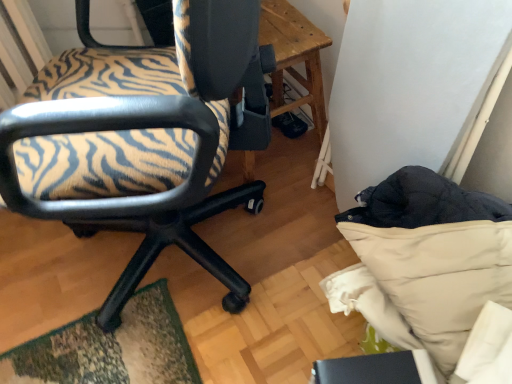
The width and height of the screenshot is (512, 384). Describe the element at coordinates (153, 127) in the screenshot. I see `zebra-patterned fabric chair at left` at that location.

What is the approximate height of zebra-patterned fabric chair at left?

86.27 centimeters.

Where is `zebra-patterned fabric chair at left`? Image resolution: width=512 pixels, height=384 pixels. zebra-patterned fabric chair at left is located at coordinates (153, 127).

Identify the location of zebra-patterned fabric chair at left. (153, 127).